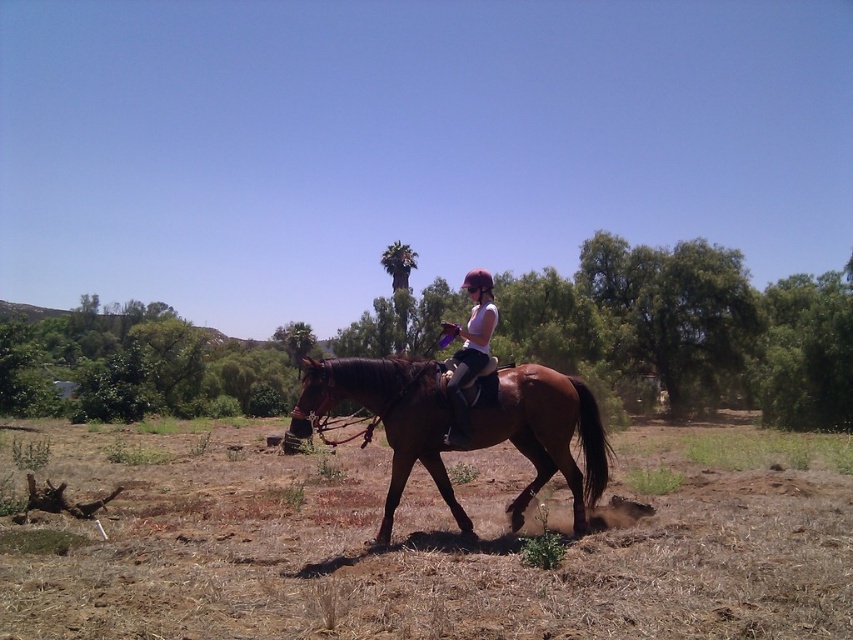
Does point (254, 627) come in front of point (485, 369)?

Yes, it is in front of point (485, 369).

Which is more to the left, brown soil at lower center or white matte shirt at center?

From the viewer's perspective, brown soil at lower center appears more on the left side.

You are a GUI agent. You are given a task and a screenshot of the screen. Output one action in this format:
    pyautogui.click(x=<x>, y=<y>)
    Task: Click on the brown soil at lower center
    
    Given the screenshot: What is the action you would take?
    pyautogui.click(x=419, y=552)

Which is below, shiny brown horse at center or white matte shirt at center?

shiny brown horse at center

Is shiny brown horse at center wider than white matte shirt at center?

Indeed, shiny brown horse at center has a greater width compared to white matte shirt at center.

What do you see at coordinates (543, 433) in the screenshot? The image size is (853, 640). I see `shiny brown horse at center` at bounding box center [543, 433].

Where is `shiny brown horse at center`? This screenshot has width=853, height=640. shiny brown horse at center is located at coordinates (543, 433).

Is brown soil at lower center positioned in front of shiny brown horse at center?

That is True.

Who is positioned more to the left, brown soil at lower center or shiny brown horse at center?

brown soil at lower center

Which is in front, point (268, 632) or point (582, 436)?

Positioned in front is point (268, 632).

You are a GUI agent. You are given a task and a screenshot of the screen. Output one action in this format:
    pyautogui.click(x=<x>, y=<y>)
    Task: Click on the brown soil at lower center
    
    Given the screenshot: What is the action you would take?
    pyautogui.click(x=419, y=552)